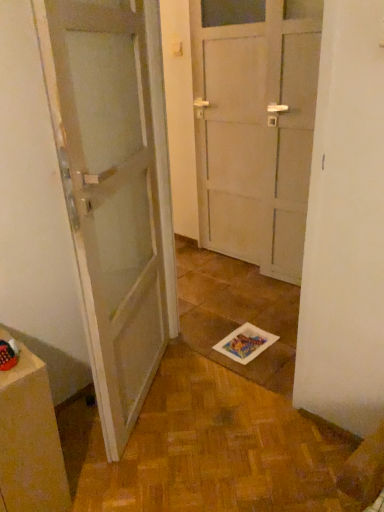
Question: Looking at the image, does white glossy door at left seem bigger or smaller compared to matte brown cabinet at lower left?

Choices:
 (A) big
 (B) small

Answer: (A)

Question: Based on their positions, is white glossy door at left located to the left or right of matte brown cabinet at lower left?

Choices:
 (A) right
 (B) left

Answer: (A)

Question: Does point (165, 135) appear closer or farther from the camera than point (41, 470)?

Choices:
 (A) farther
 (B) closer

Answer: (A)

Question: Does point (14, 428) appear closer or farther from the camera than point (150, 87)?

Choices:
 (A) closer
 (B) farther

Answer: (A)

Question: Which is correct: matte brown cabinet at lower left is inside white glossy door at left, or outside of it?

Choices:
 (A) outside
 (B) inside

Answer: (A)

Question: From their relative heights in the image, would you say matte brown cabinet at lower left is taller or shorter than white glossy door at left?

Choices:
 (A) tall
 (B) short

Answer: (B)

Question: In terms of size, does matte brown cabinet at lower left appear bigger or smaller than white glossy door at left?

Choices:
 (A) big
 (B) small

Answer: (B)